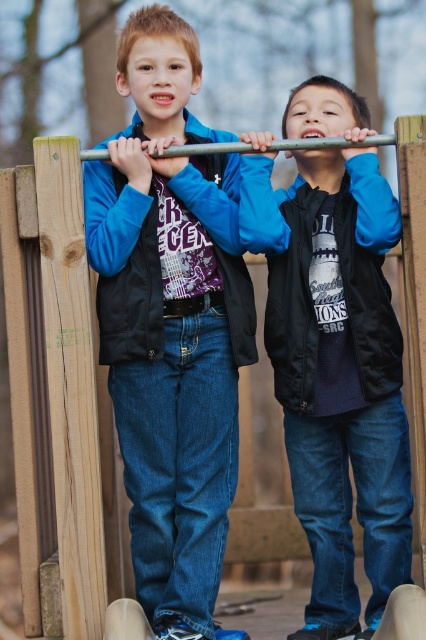
This screenshot has height=640, width=426. I want to click on black matte vest at center, so click(336, 369).

Is black matte vest at center taller than black fabric jacket at upper center?

Yes.

Which is behind, point (244, 212) or point (276, 202)?

Positioned behind is point (276, 202).

This screenshot has height=640, width=426. In order to click on black matte vest at center in this screenshot , I will do `click(336, 369)`.

Does matte black jacket at center appear under metallic pole at center?

Yes.

Which of these two, matte black jacket at center or metallic pole at center, stands shorter?

metallic pole at center is shorter.

Between point (94, 182) and point (239, 147), which one is positioned behind?

Positioned behind is point (94, 182).

At what (x,y) coordinates should I click in order to perform the action: click on matte black jacket at center. Please return your answer as a coordinate pair (x, y). The image size is (426, 640). Looking at the image, I should click on (123, 266).

Is matte black vest at center shorter than metallic pole at center?

No.

Measure the distance between point (141, 561) and camera.

Point (141, 561) is 9.16 meters away from camera.

You are a GUI agent. You are given a task and a screenshot of the screen. Output one action in this format:
    pyautogui.click(x=<x>, y=<y>)
    Task: Click on the matte black vest at center
    The image size is (426, 640).
    Given the screenshot: What is the action you would take?
    pyautogui.click(x=170, y=324)